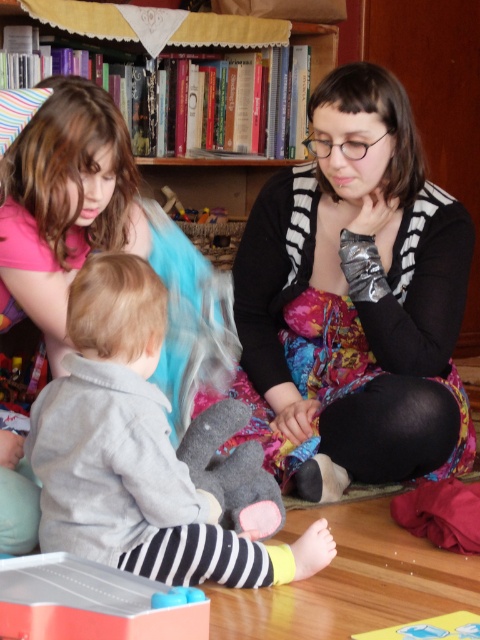
You are organizing a clothing donation drive and need to determine which sweater takes up more space in the donation box. Based on the image, which sweater between the black and white striped sweater at center and the gray soft sweater at center is larger?

The black and white striped sweater at center is bigger than the gray soft sweater at center, so it takes up more space in the donation box.

You are a parent trying to organize toys. You have two toys to place on a shelf. The translucent plastic toy at lower left and the smooth plastic toy at lower center. Which toy requires a bigger space on the shelf?

The translucent plastic toy at lower left requires a bigger space on the shelf because it is larger in size than the smooth plastic toy at lower center.

You are a parent trying to organize the toys in the living room. You see the black and white striped sweater at center and the smooth plastic toy at lower center. Which item is taller?

The black and white striped sweater at center is taller than the smooth plastic toy at lower center.